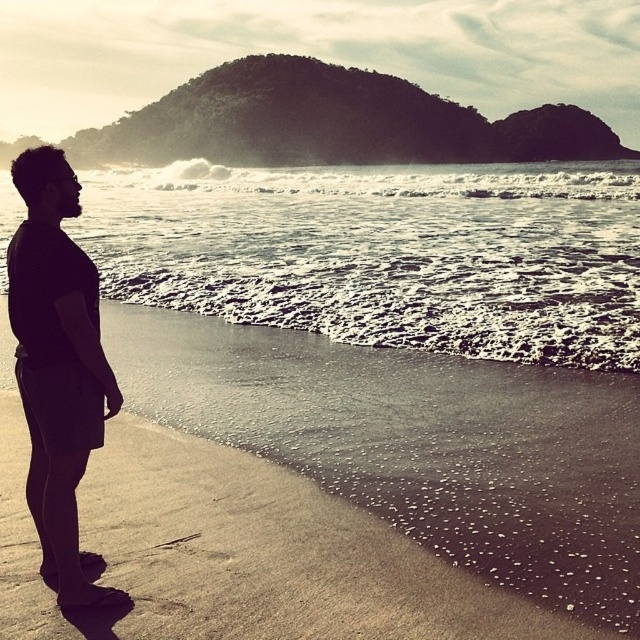
The image size is (640, 640). What do you see at coordinates (385, 252) in the screenshot?
I see `white frothy water at center` at bounding box center [385, 252].

Which is in front, point (468, 316) or point (40, 492)?

Point (40, 492) is in front.

Identify the location of white frothy water at center. (385, 252).

Is sandy beach at lower left positioned behind black matte shorts at left?

That is True.

Does sandy beach at lower left appear on the right side of black matte shorts at left?

Indeed, sandy beach at lower left is positioned on the right side of black matte shorts at left.

Image resolution: width=640 pixels, height=640 pixels. Identify the location of sandy beach at lower left. (419, 444).

At what (x,y) coordinates should I click in order to perform the action: click on sandy beach at lower left. Please return your answer as a coordinate pair (x, y). This screenshot has width=640, height=640. Looking at the image, I should click on (419, 444).

Between sandy beach at lower left and white frothy water at center, which one appears on the right side from the viewer's perspective?

white frothy water at center

Image resolution: width=640 pixels, height=640 pixels. I want to click on sandy beach at lower left, so click(x=419, y=444).

Locate an element on the screen. This screenshot has width=640, height=640. sandy beach at lower left is located at coordinates (419, 444).